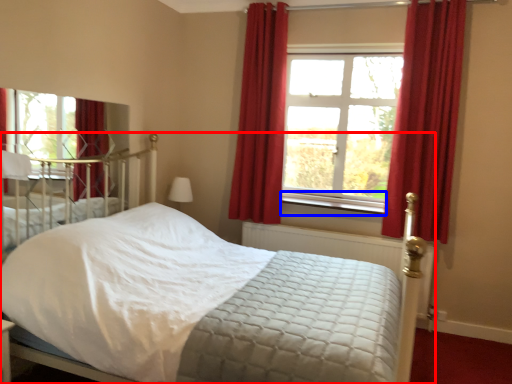
Question: Which object is closer to the camera taking this photo, bed (highlighted by a red box) or window sill (highlighted by a blue box)?

Choices:
 (A) bed
 (B) window sill

Answer: (A)